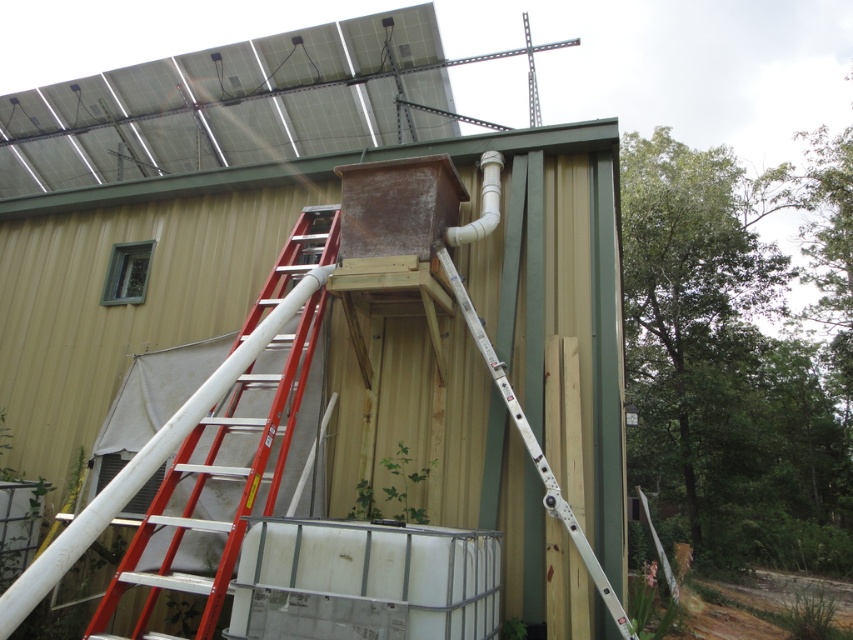
You are a painter standing at the base of the building and need to reach the top of the red metallic ladder at left and the white metallic ladder at center. Which ladder should you climb first to reach the higher point without moving your position?

The red metallic ladder at left is closer to the viewer than the white metallic ladder at center, so climbing the red metallic ladder at left first would allow you to reach a higher point since it is nearer and thus its top is higher relative to your position.

You are standing in front of the building and want to determine which of the two points, point (x=181, y=529) or point (x=532, y=445), is closer to you. Can you identify which one?

Point (x=181, y=529) is closer to you because it is further to the viewer than point (x=532, y=445).

You are a construction worker standing at the base of the building. You need to access the roof to inspect the solar panels. The red metallic ladder at left is behind the rusty metal box at center. Can you see the ladder from your current position?

The red metallic ladder at left is behind the rusty metal box at center, so it is obstructed by the box and not visible from your current position at the base of the building.